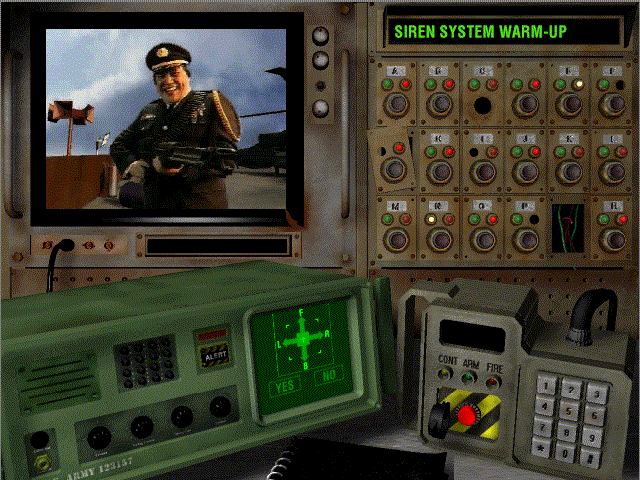
Find the location of a particular element. keypad is located at coordinates (564, 420).